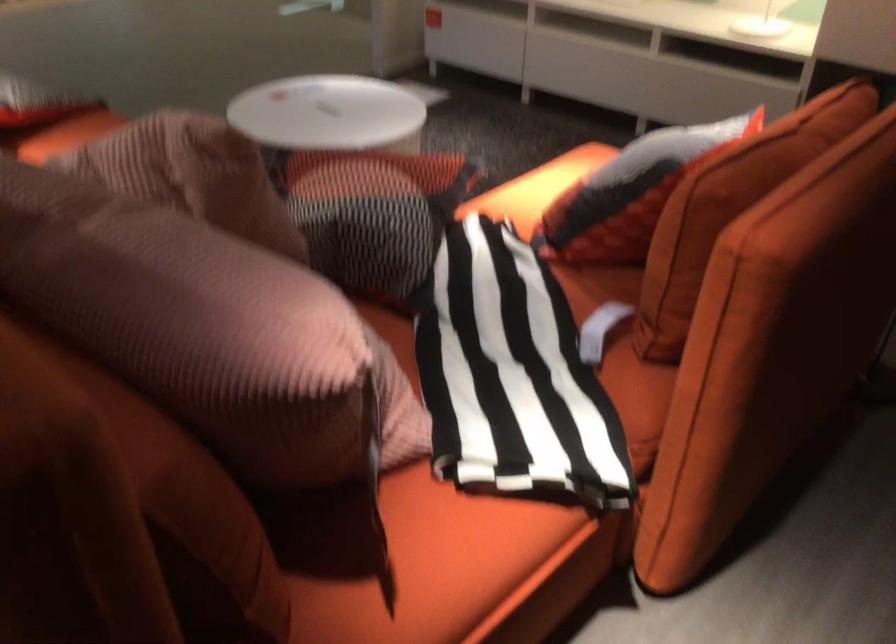
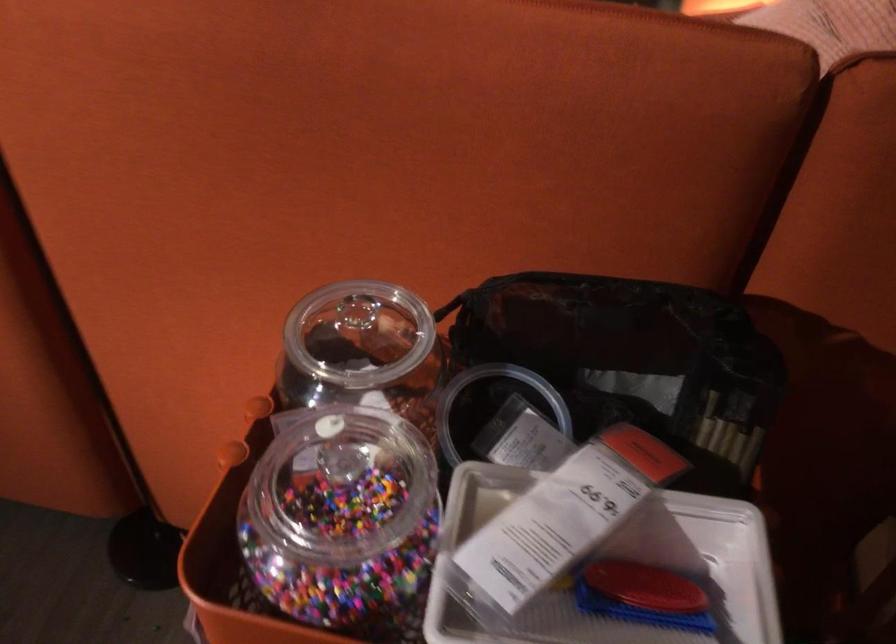
Question: The images are taken continuously from a first-person perspective. In which direction are you moving?

Choices:
 (A) Left
 (B) Right
 (C) Forward
 (D) Backward

Answer: (A)